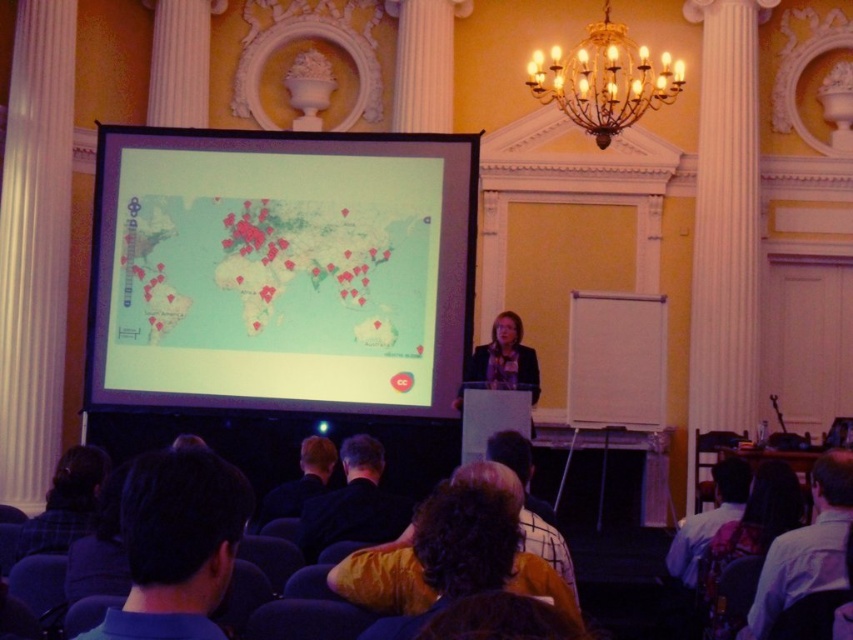
Consider the image. Is light blue shirt at lower right taller than dark blue shirt at center?

Correct, light blue shirt at lower right is much taller as dark blue shirt at center.

Is light blue shirt at lower right bigger than dark blue shirt at center?

Yes.

The image size is (853, 640). Describe the element at coordinates (708, 520) in the screenshot. I see `light blue shirt at lower right` at that location.

The image size is (853, 640). In order to click on light blue shirt at lower right in this screenshot , I will do `click(708, 520)`.

Who is more forward, (x=596, y=81) or (x=349, y=480)?

Point (x=349, y=480)

Which is behind, point (581, 99) or point (299, 524)?

The point (581, 99) is behind.

Where is `gold metallic chandelier at upper center`? The height and width of the screenshot is (640, 853). gold metallic chandelier at upper center is located at coordinates (604, 80).

Is dark blue shirt at lower left positioned at the back of black fabric shirt at lower center?

No, it is not.

Is point (192, 600) more distant than point (320, 524)?

No, it is in front of (320, 524).

Locate an element on the screen. This screenshot has width=853, height=640. dark blue shirt at lower left is located at coordinates (177, 545).